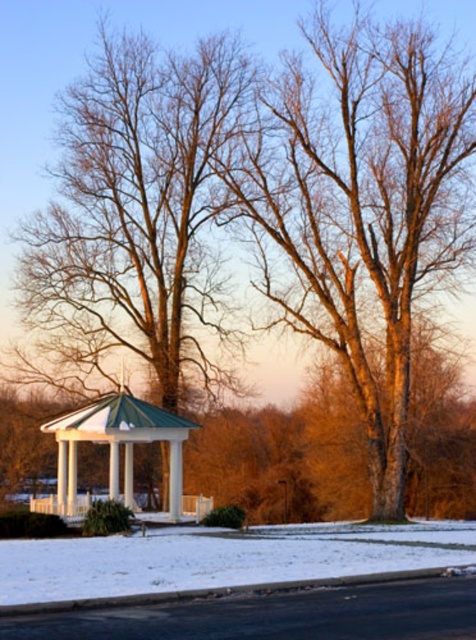
Consider the image. You are planning to place a small wooden bench in the winter scene. The bench requires a space wider than the white glossy gazebo at center. Can the white powdery snow at lower center accommodate the bench?

The white powdery snow at lower center has a width that surpasses the white glossy gazebo at center, so yes, the bench can be placed there as it provides sufficient width.

You are standing in the snowy park and see the gazebo. Which tree, the bare wood tree at center or the brown wood tree at center, is positioned to the right when facing the gazebo?

The bare wood tree at center is positioned to the right of the brown wood tree at center when facing the gazebo.

You are standing at the gazebo in the winter scene. You see a point marked at coordinates (363, 204). Which object is this point located on?

The point marked at coordinates (363, 204) is located on the bare wood tree at center.